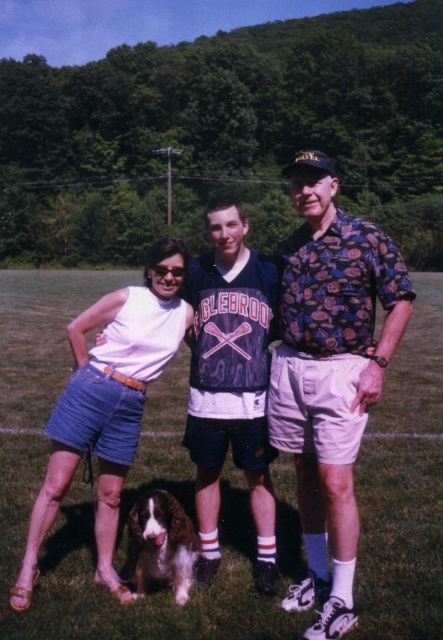
Which of these two, floral-patterned shirt at center or white fur dog at lower center, stands shorter?

white fur dog at lower center

How much distance is there between floral-patterned shirt at center and white fur dog at lower center?

floral-patterned shirt at center and white fur dog at lower center are 38.96 inches apart from each other.

I want to click on floral-patterned shirt at center, so click(x=330, y=372).

Does point (357, 333) lie in front of point (80, 314)?

Yes.

Who is positioned more to the right, floral-patterned shirt at center or white denim shorts at left?

floral-patterned shirt at center is more to the right.

Between point (315, 406) and point (121, 452), which one is positioned in front?

Point (315, 406)

This screenshot has height=640, width=443. Find the location of `floral-patterned shirt at center`. floral-patterned shirt at center is located at coordinates (330, 372).

Is white denim shorts at left to the right of white fur dog at lower center from the viewer's perspective?

No, white denim shorts at left is not to the right of white fur dog at lower center.

Which is more to the right, white denim shorts at left or white fur dog at lower center?

white fur dog at lower center is more to the right.

Between point (46, 476) and point (178, 516), which one is positioned behind?

The point (46, 476) is behind.

This screenshot has height=640, width=443. What are the coordinates of `white denim shorts at left` in the screenshot? It's located at (108, 404).